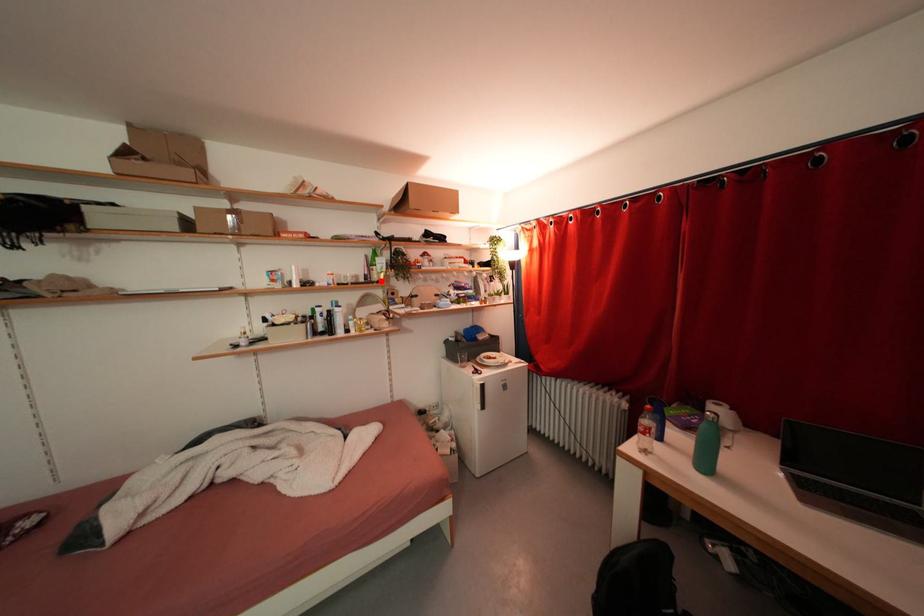
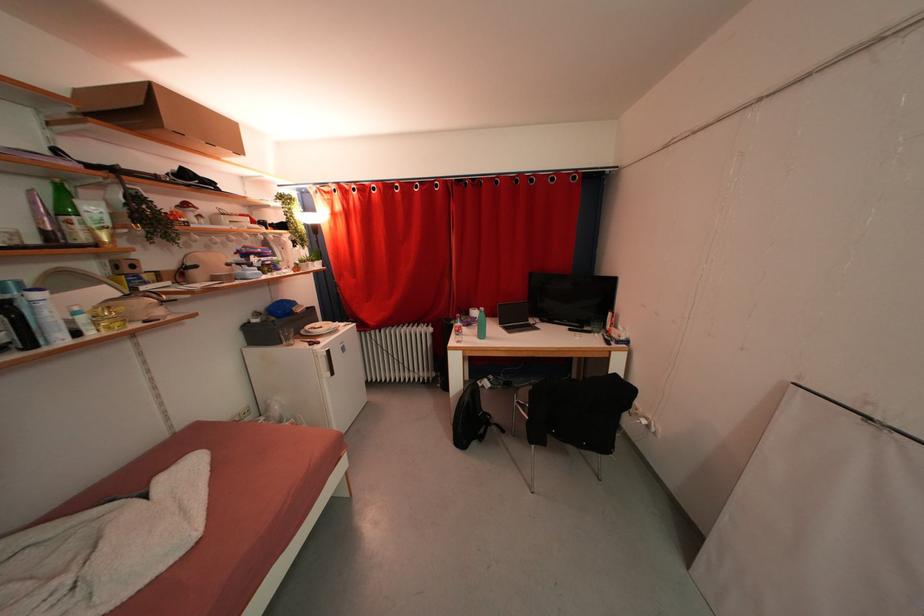
In the second image, find the point that corresponds to the highlighted location in the first image.

(89, 241)